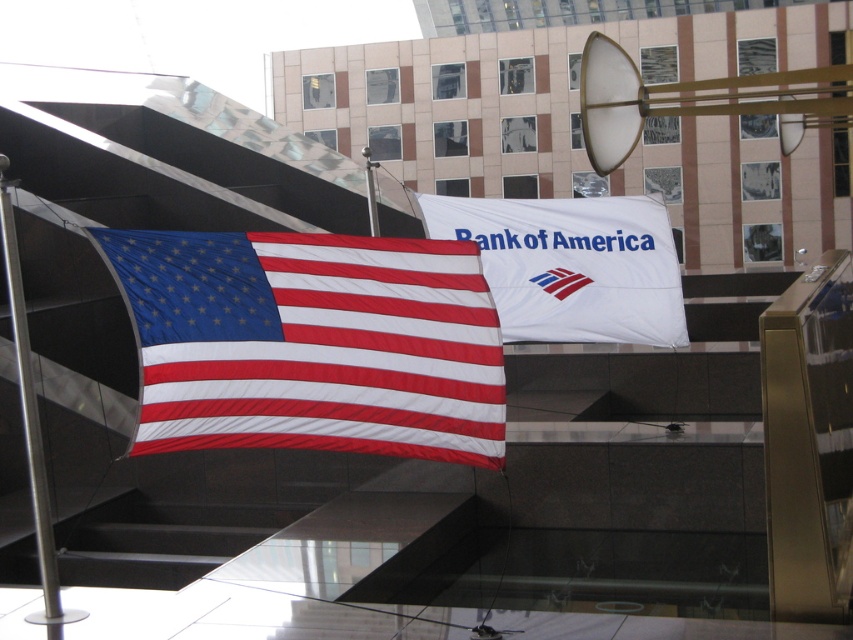
Between matte fabric flag at center and white matte flag at center, which one is positioned lower?

matte fabric flag at center

Can you confirm if matte fabric flag at center is positioned below white matte flag at center?

Yes.

Is point (326, 243) farther from viewer compared to point (553, 272)?

No, (326, 243) is in front of (553, 272).

The width and height of the screenshot is (853, 640). Find the location of `matte fabric flag at center`. matte fabric flag at center is located at coordinates (312, 342).

Is matte fabric flag at center shorter than silver metallic pole at left?

Indeed, matte fabric flag at center has a lesser height compared to silver metallic pole at left.

Which is in front, point (177, 273) or point (24, 320)?

Positioned in front is point (177, 273).

Locate an element on the screen. matte fabric flag at center is located at coordinates (312, 342).

You are a GUI agent. You are given a task and a screenshot of the screen. Output one action in this format:
    pyautogui.click(x=<x>, y=<y>)
    Task: Click on the matte fabric flag at center
    This screenshot has height=640, width=853.
    Given the screenshot: What is the action you would take?
    pyautogui.click(x=312, y=342)

The image size is (853, 640). Identify the location of white matte flag at center. (572, 266).